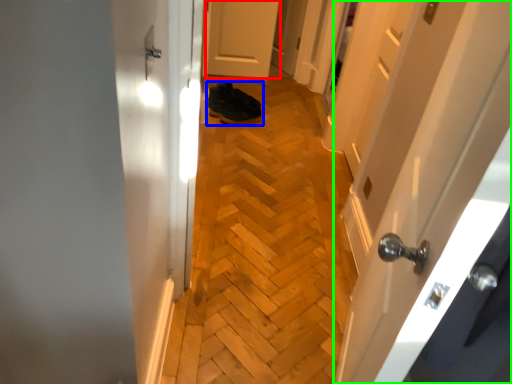
Question: Which is farther away from door (highlighted by a red box)? footwear (highlighted by a blue box) or door (highlighted by a green box)?

Choices:
 (A) footwear
 (B) door

Answer: (B)